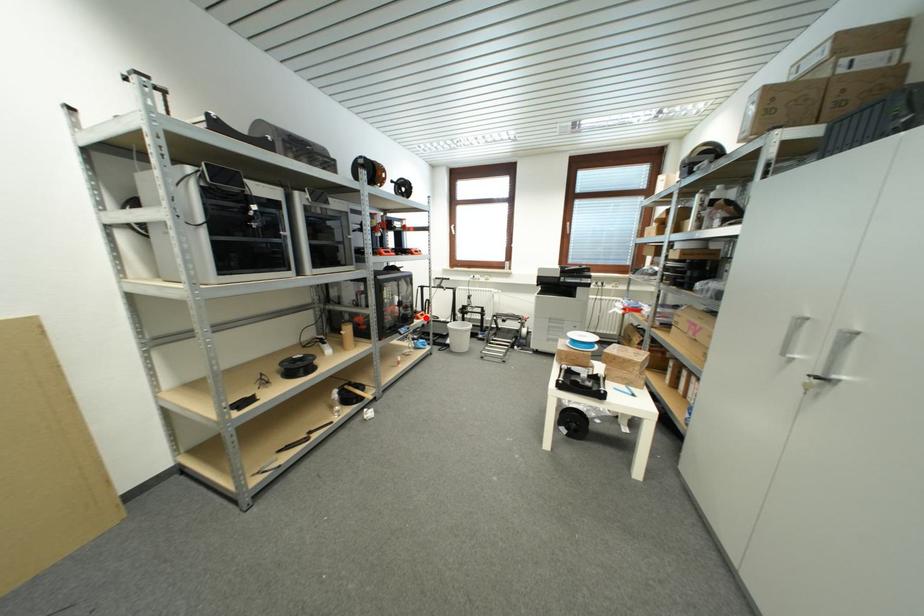
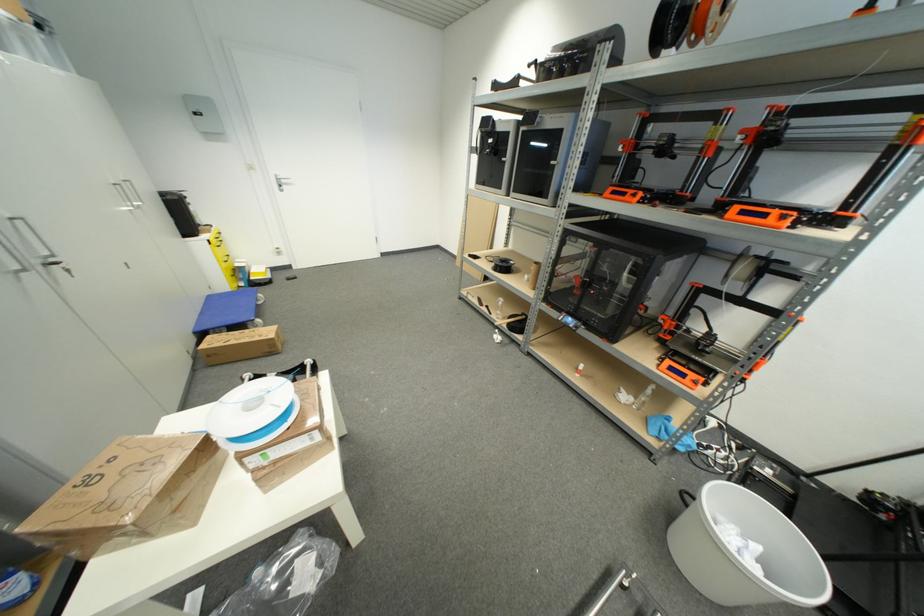
Question: A red point is marked in image1. In image2, is the corresponding 3D point closer to the camera or farther? Reply with the corresponding letter.

Choices:
 (A) The corresponding 3D point is closer.
 (B) The corresponding 3D point is farther.

Answer: (B)